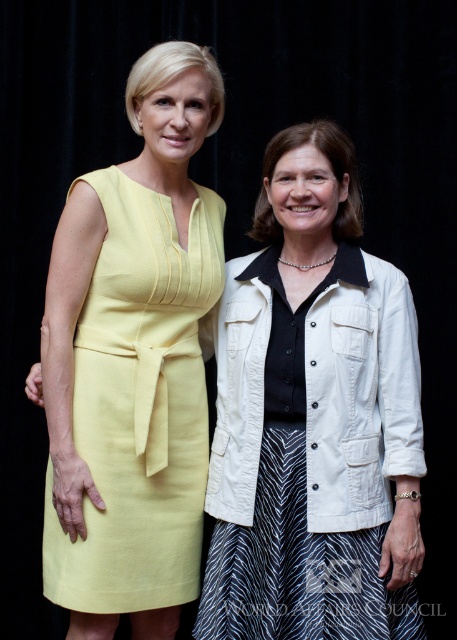
Question: Which point is closer to the camera?

Choices:
 (A) (281, 250)
 (B) (132, 224)

Answer: (B)

Question: Which of the following is the farthest from the observer?

Choices:
 (A) white textured jacket at center
 (B) linen yellow dress at left

Answer: (B)

Question: Can you confirm if white textured jacket at center is smaller than linen yellow dress at left?

Choices:
 (A) yes
 (B) no

Answer: (B)

Question: Does white textured jacket at center have a lesser width compared to linen yellow dress at left?

Choices:
 (A) yes
 (B) no

Answer: (B)

Question: Where is white textured jacket at center located in relation to linen yellow dress at left in the image?

Choices:
 (A) left
 (B) right

Answer: (B)